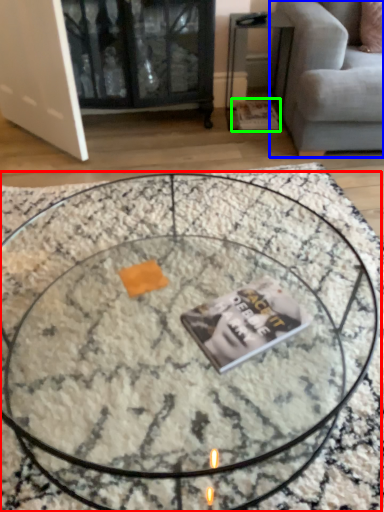
Question: Which is farther away from coffee table (highlighted by a red box)? studio couch (highlighted by a blue box) or magazine (highlighted by a green box)?

Choices:
 (A) studio couch
 (B) magazine

Answer: (B)